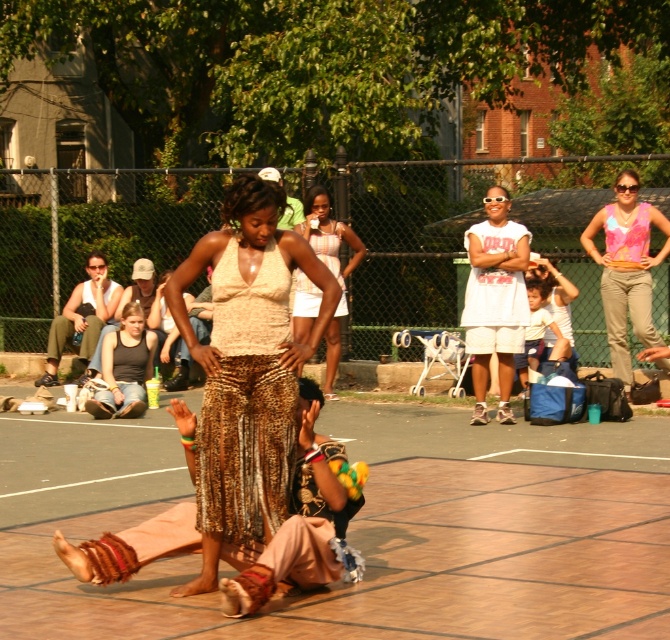
Describe the element at coordinates (247, 403) in the screenshot. I see `leopard print fabric skirt at center` at that location.

Is leopard print fabric skirt at center closer to the viewer compared to pink floral tank top at center?

Yes, it is in front of pink floral tank top at center.

Who is more forward, [222,308] or [624,344]?

Positioned in front is point [222,308].

Where is `leopard print fabric skirt at center`? This screenshot has height=640, width=670. leopard print fabric skirt at center is located at coordinates (247, 403).

Does brown leather court at center appear over matte white tank top at upper left?

No, brown leather court at center is not above matte white tank top at upper left.

In the scene shown: Who is lower down, brown leather court at center or matte white tank top at upper left?

brown leather court at center

Is point (603, 515) more distant than point (111, 316)?

That is False.

You are a GUI agent. You are given a task and a screenshot of the screen. Output one action in this format:
    pyautogui.click(x=<x>, y=<y>)
    Task: Click on the brown leather court at center
    This screenshot has height=640, width=670.
    Given the screenshot: What is the action you would take?
    pyautogui.click(x=364, y=529)

Who is lower down, leopard print skirt at center or pink floral tank top at center?

leopard print skirt at center is below.

Describe the element at coordinates (247, 372) in the screenshot. The image size is (670, 640). I see `leopard print skirt at center` at that location.

Does point (234, 412) come farther from viewer compared to point (653, 333)?

No, (234, 412) is closer to viewer.

Identify the location of leopard print skirt at center. This screenshot has height=640, width=670. (247, 372).